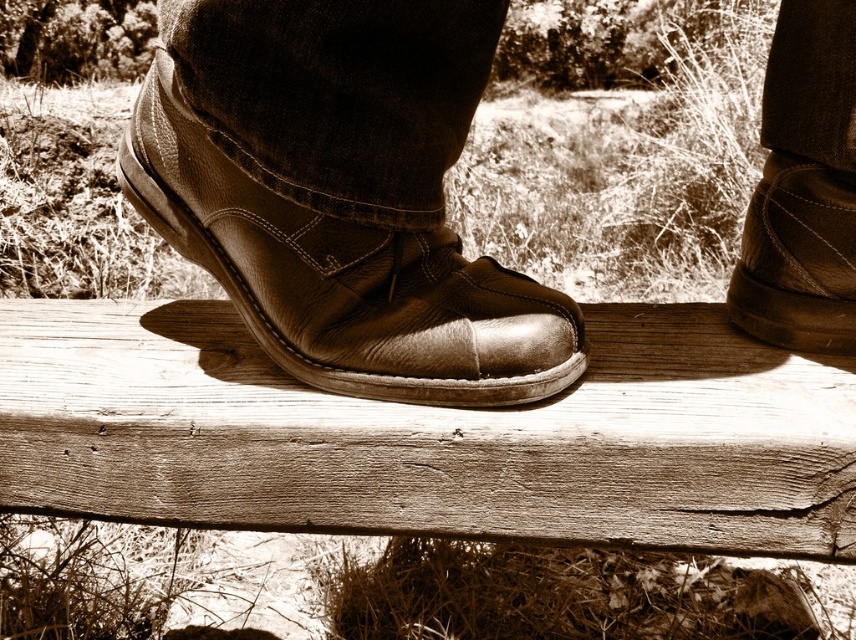
Question: Does shiny brown leather shoe at center have a larger size compared to leather boot at right?

Choices:
 (A) no
 (B) yes

Answer: (B)

Question: Does shiny brown leather shoe at center have a greater width compared to leather boot at right?

Choices:
 (A) no
 (B) yes

Answer: (B)

Question: Can you confirm if shiny brown leather shoe at center is thinner than leather boot at right?

Choices:
 (A) no
 (B) yes

Answer: (A)

Question: Which point is closer to the camera?

Choices:
 (A) shiny brown leather shoe at center
 (B) leather boot at right

Answer: (A)